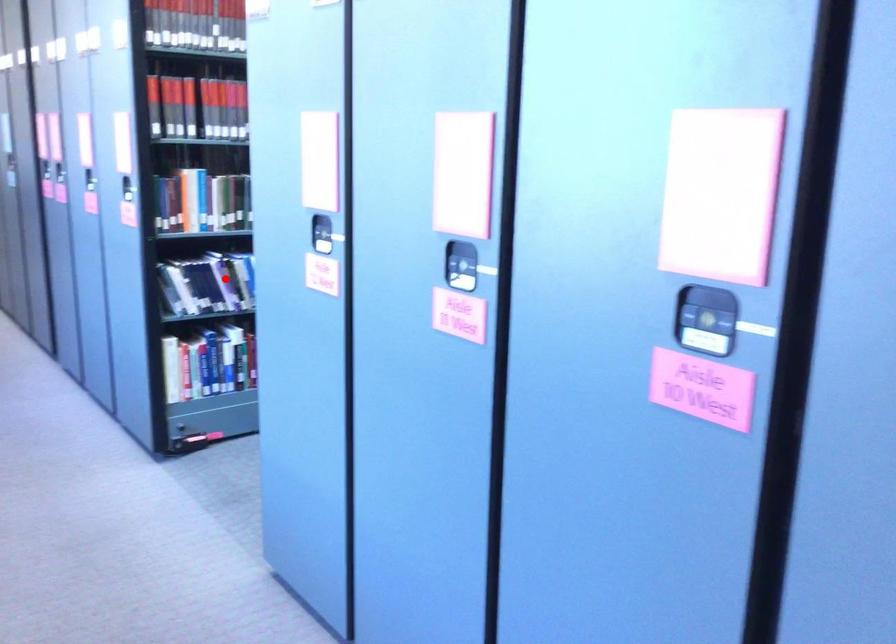
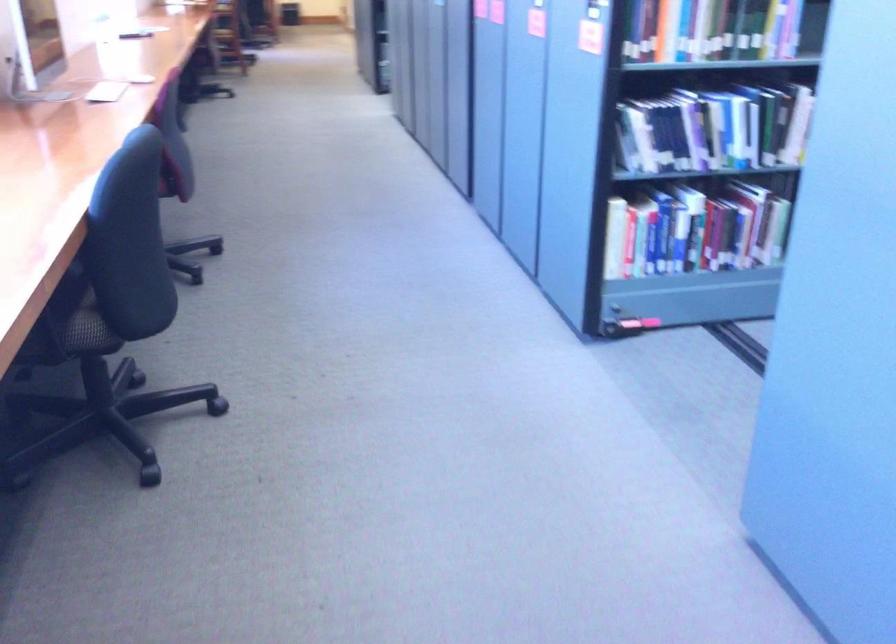
Locate, in the second image, the point that corresponds to the highlighted location in the first image.

(695, 129)